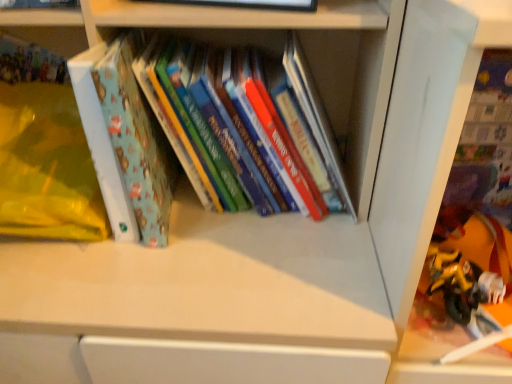
Question: From a real-world perspective, is matte blue book at left on top of yellow matte toy at lower right?

Choices:
 (A) yes
 (B) no

Answer: (A)

Question: Does matte blue book at left turn towards yellow matte toy at lower right?

Choices:
 (A) no
 (B) yes

Answer: (A)

Question: From the image's perspective, does matte blue book at left appear lower than yellow matte toy at lower right?

Choices:
 (A) yes
 (B) no

Answer: (B)

Question: Is matte blue book at left smaller than yellow matte toy at lower right?

Choices:
 (A) yes
 (B) no

Answer: (B)

Question: Considering the relative sizes of matte blue book at left and yellow matte toy at lower right in the image provided, is matte blue book at left wider than yellow matte toy at lower right?

Choices:
 (A) yes
 (B) no

Answer: (A)

Question: Does matte blue book at left have a larger size compared to yellow matte toy at lower right?

Choices:
 (A) no
 (B) yes

Answer: (B)

Question: Is hardcover books at center, the second book in the top-to-bottom sequence, shorter than matte blue book at upper left, placed as the second book when sorted from bottom to top?

Choices:
 (A) no
 (B) yes

Answer: (A)

Question: Is hardcover books at center, the second book in the top-to-bottom sequence, wider than matte blue book at upper left, placed as the second book when sorted from bottom to top?

Choices:
 (A) yes
 (B) no

Answer: (A)

Question: Is hardcover books at center, which is the first book in bottom-to-top order, at the right side of matte blue book at upper left, placed as the second book when sorted from bottom to top?

Choices:
 (A) no
 (B) yes

Answer: (B)

Question: Can you see hardcover books at center, which is the first book in bottom-to-top order, touching matte blue book at upper left, the first book from the top?

Choices:
 (A) no
 (B) yes

Answer: (A)

Question: Would you say hardcover books at center, the 1th book in the right-to-left sequence, is outside matte blue book at upper left, the first book from the top?

Choices:
 (A) yes
 (B) no

Answer: (A)

Question: From a real-world perspective, is hardcover books at center, the second book in the top-to-bottom sequence, on top of matte blue book at upper left, placed as the 1th book when sorted from left to right?

Choices:
 (A) no
 (B) yes

Answer: (A)

Question: Is yellow matte toy at lower right not close to matte blue book at left?

Choices:
 (A) yes
 (B) no

Answer: (B)